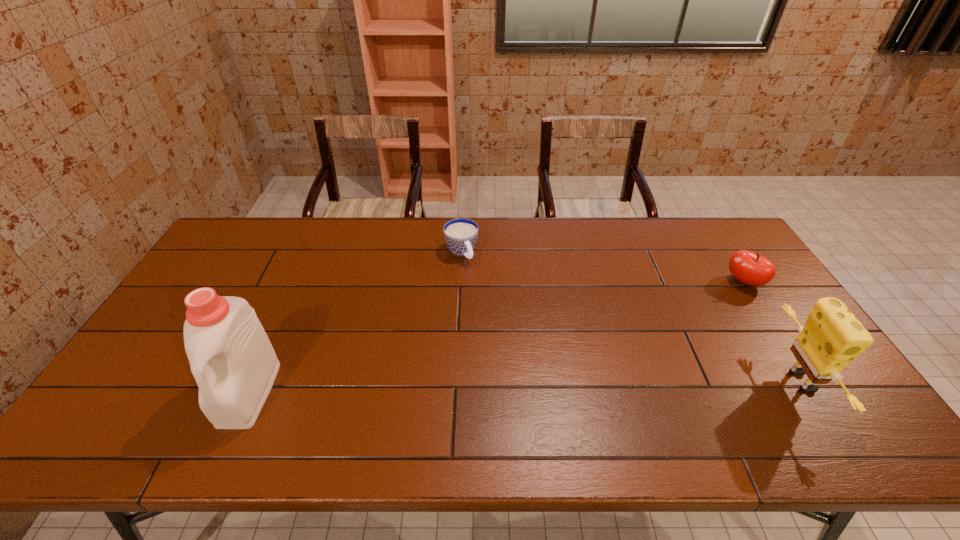
I want to click on vacant spot on the desktop that is between the leftmost object and the sponge and is positioned on the side of the cup with the handle, so click(x=548, y=387).

Locate an element on the screen. This screenshot has height=540, width=960. vacant space on the desktop that is between the tallest object and the sponge and is positioned on the stem of the second farthest object is located at coordinates [584, 386].